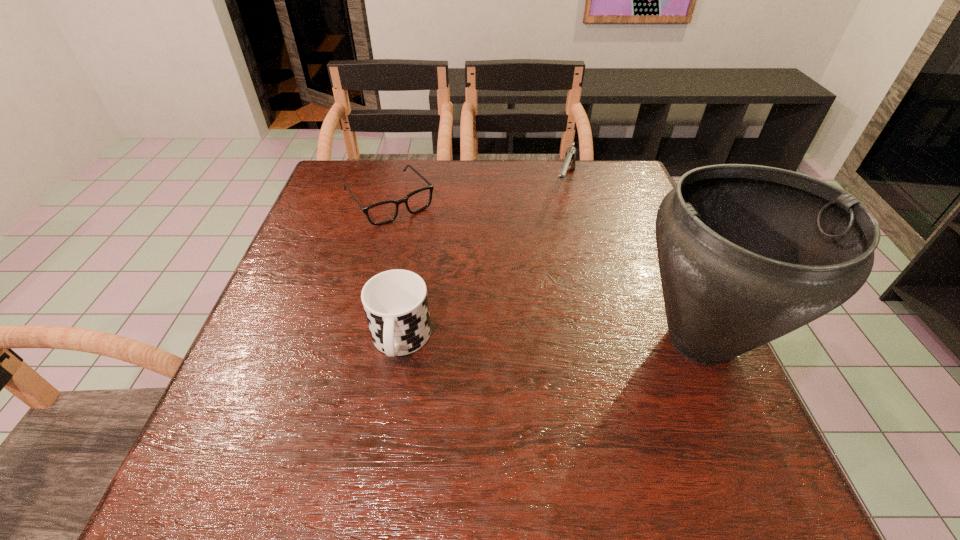
At what (x,y) coordinates should I click in order to perform the action: click on object located at the near right corner. Please return your answer as a coordinate pair (x, y). Looking at the image, I should click on (747, 254).

You are a GUI agent. You are given a task and a screenshot of the screen. Output one action in this format:
    pyautogui.click(x=<x>, y=<y>)
    Task: Click on the free spot at the far edge of the desktop
    This screenshot has width=960, height=540.
    Given the screenshot: What is the action you would take?
    pos(394,176)

The height and width of the screenshot is (540, 960). What are the coordinates of `vacant space at the near edge` in the screenshot? It's located at (486, 418).

The image size is (960, 540). What are the coordinates of `vacant space at the left edge of the desktop` in the screenshot? It's located at (275, 361).

Locate an element on the screen. The image size is (960, 540). free region at the right edge of the desktop is located at coordinates (660, 356).

Where is `vacant point at the far left corner`? The width and height of the screenshot is (960, 540). vacant point at the far left corner is located at coordinates (379, 185).

Identify the location of blank space at the near left corner of the desktop. (271, 419).

I want to click on blank space at the far right corner of the desktop, so click(616, 187).

This screenshot has height=540, width=960. Find the location of `vacant area between the cup and the tallest object`. vacant area between the cup and the tallest object is located at coordinates (551, 341).

What are the coordinates of `vacant space that's between the shortest object and the urn` in the screenshot? It's located at (545, 271).